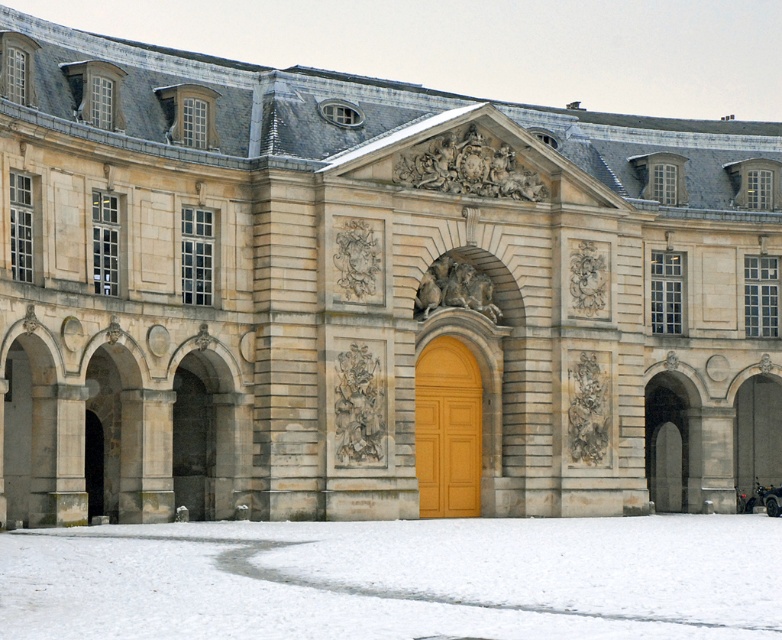
Question: Does white powdery snow at lower center appear on the right side of matte wood door at center?

Choices:
 (A) no
 (B) yes

Answer: (A)

Question: Which object appears farthest from the camera in this image?

Choices:
 (A) matte wood door at center
 (B) white powdery snow at lower center

Answer: (A)

Question: Can you confirm if white powdery snow at lower center is smaller than matte wood door at center?

Choices:
 (A) no
 (B) yes

Answer: (A)

Question: Which point is closer to the camera?

Choices:
 (A) (529, 556)
 (B) (468, 476)

Answer: (A)

Question: Does white powdery snow at lower center have a greater width compared to matte wood door at center?

Choices:
 (A) no
 (B) yes

Answer: (B)